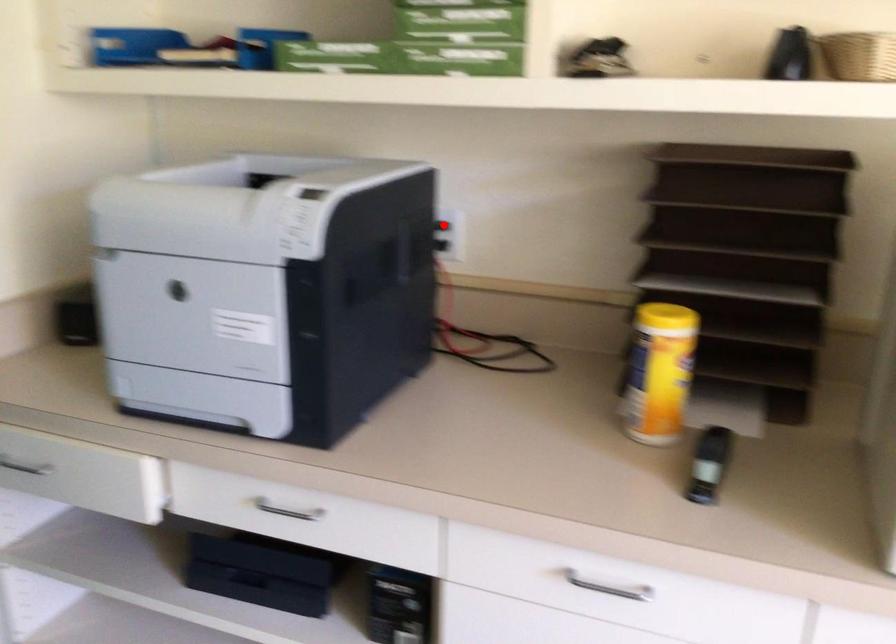
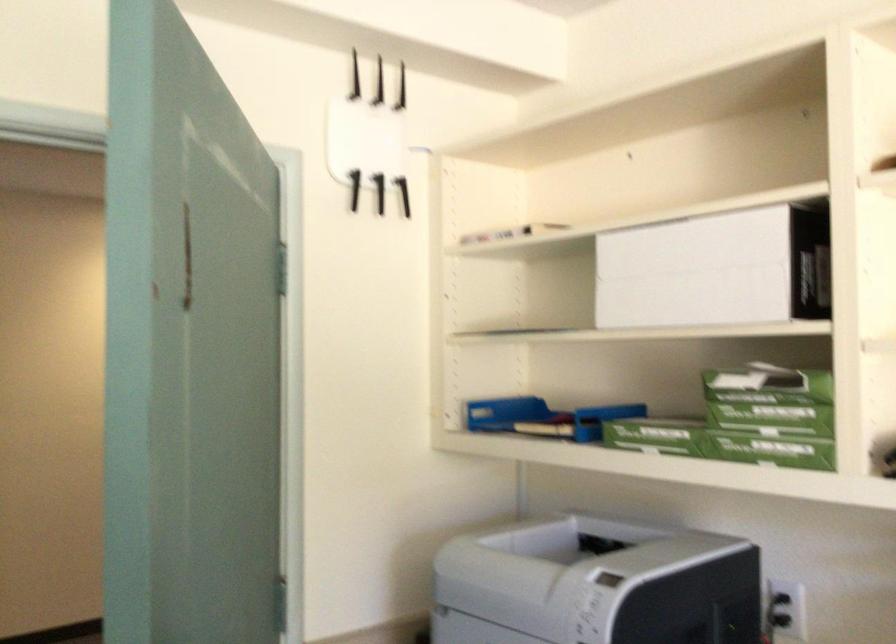
In the second image, find the point that corresponds to the highlighted location in the first image.

(782, 609)